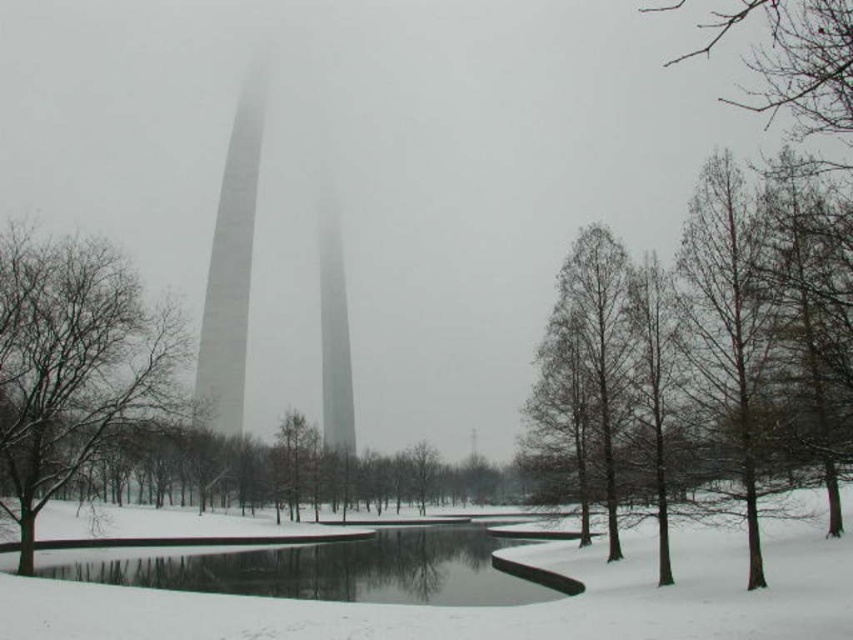
Question: Which point is farther to the camera?

Choices:
 (A) (239, 218)
 (B) (604, 438)
 (C) (386, 586)
 (D) (664, 429)

Answer: (A)

Question: Does snow-covered tree at left appear on the right side of black smooth pond at center?

Choices:
 (A) yes
 (B) no

Answer: (B)

Question: Among these objects, which one is nearest to the camera?

Choices:
 (A) white smooth tower at center
 (B) brown bark tree at right
 (C) snow-covered tree at left
 (D) black smooth pond at center

Answer: (B)

Question: Is brown bark tree at right to the right of brown/dry wood tree at center-right from the viewer's perspective?

Choices:
 (A) yes
 (B) no

Answer: (A)

Question: Does snow-covered tree at left lie in front of brown/dry wood tree at center-right?

Choices:
 (A) yes
 (B) no

Answer: (B)

Question: Which of the following is the farthest from the observer?

Choices:
 (A) snow-covered tree at left
 (B) brown/dry wood tree at center-right

Answer: (A)